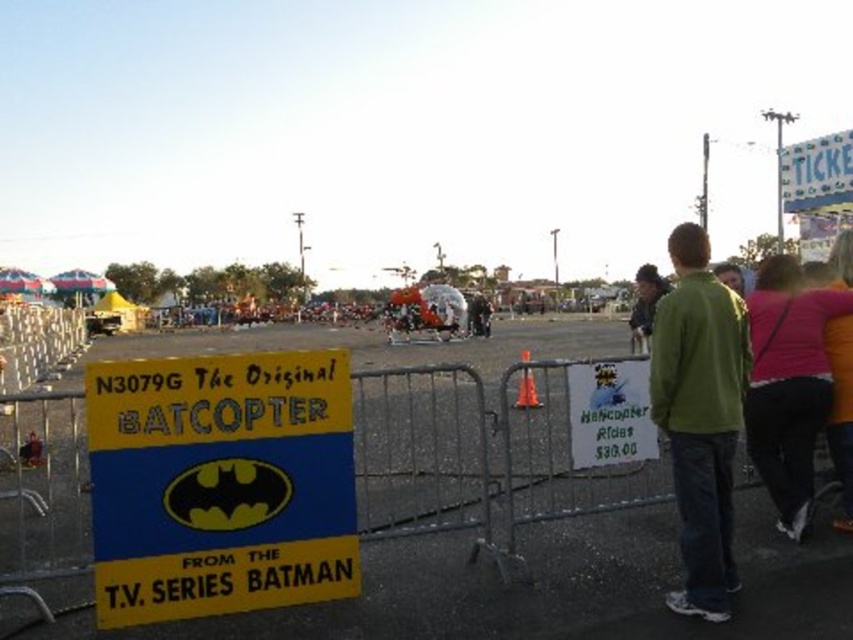
Is point (820, 396) positioned after point (631, 310)?

No, it is in front of (631, 310).

Does pink fabric shirt at right come in front of green cotton hoodie at center?

Yes, it is in front of green cotton hoodie at center.

You are a GUI agent. You are given a task and a screenshot of the screen. Output one action in this format:
    pyautogui.click(x=<x>, y=<y>)
    Task: Click on the pink fabric shirt at right
    
    Given the screenshot: What is the action you would take?
    click(788, 384)

Find the location of a particular element. Image resolution: width=853 pixels, height=640 pixels. pink fabric shirt at right is located at coordinates (788, 384).

Is the position of green fleece jacket at center more distant than that of green cotton hoodie at center?

No, green fleece jacket at center is in front of green cotton hoodie at center.

Can you confirm if green fleece jacket at center is bigger than green cotton hoodie at center?

Incorrect, green fleece jacket at center is not larger than green cotton hoodie at center.

Who is more distant from viewer, [682,436] or [637,342]?

Positioned behind is point [637,342].

Locate an element on the screen. The image size is (853, 640). green fleece jacket at center is located at coordinates click(700, 417).

Who is more distant from viewer, (144, 554) or (784, 353)?

The point (784, 353) is more distant.

Does point (314, 448) lie in front of point (799, 442)?

Yes, it is in front of point (799, 442).

Locate an element on the screen. This screenshot has width=853, height=640. yellow paper sign at lower left is located at coordinates (219, 483).